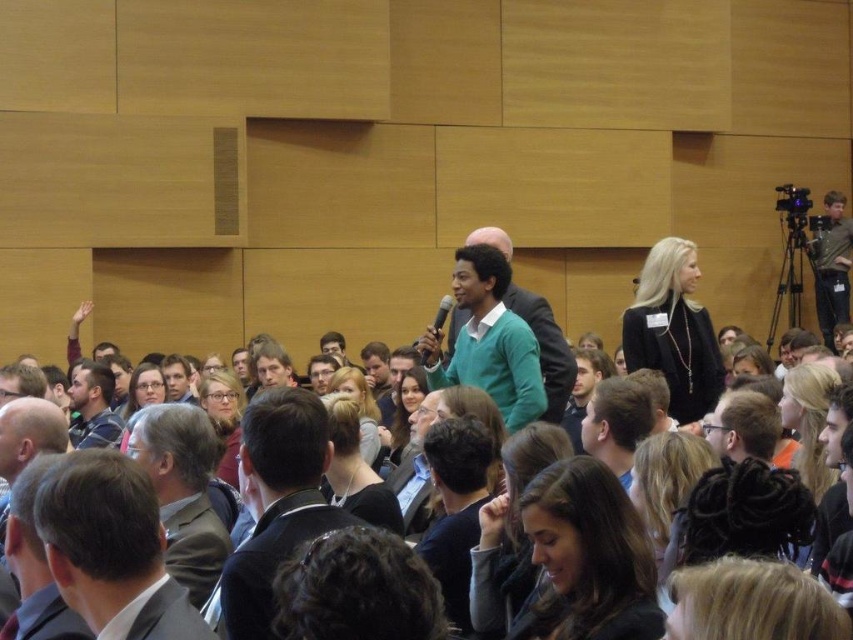
Can you confirm if dark brown hair at lower center is shorter than matte black camera at upper right?

No.

Between dark brown hair at lower center and matte black camera at upper right, which one appears on the left side from the viewer's perspective?

dark brown hair at lower center is more to the left.

Where is `dark brown hair at lower center`? Image resolution: width=853 pixels, height=640 pixels. dark brown hair at lower center is located at coordinates (587, 557).

I want to click on dark brown hair at lower center, so click(587, 557).

Which is behind, point (71, 524) or point (467, 442)?

Point (467, 442)

From the picture: Does dark brown suit at lower left appear under dark blue sweater at center?

Actually, dark brown suit at lower left is above dark blue sweater at center.

This screenshot has height=640, width=853. I want to click on dark brown suit at lower left, so click(111, 548).

Which is below, dark brown suit at center or green matte sweater at center?

dark brown suit at center

Can you confirm if dark brown suit at center is positioned to the right of green matte sweater at center?

No, dark brown suit at center is not to the right of green matte sweater at center.

The height and width of the screenshot is (640, 853). What do you see at coordinates (277, 502) in the screenshot?
I see `dark brown suit at center` at bounding box center [277, 502].

What are the coordinates of `dark brown suit at center` in the screenshot? It's located at click(x=277, y=502).